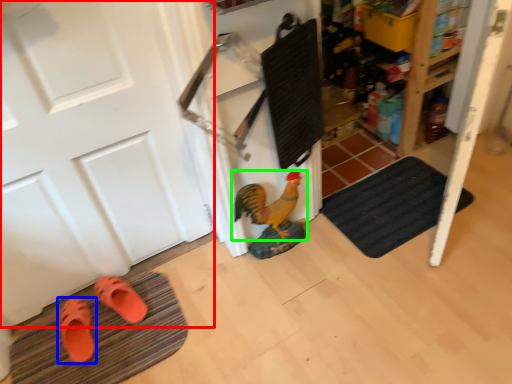
Question: Based on their relative distances, which object is nearer to door (highlighted by a red box)? Choose from footwear (highlighted by a blue box) and chicken (highlighted by a green box).

Choices:
 (A) footwear
 (B) chicken

Answer: (A)